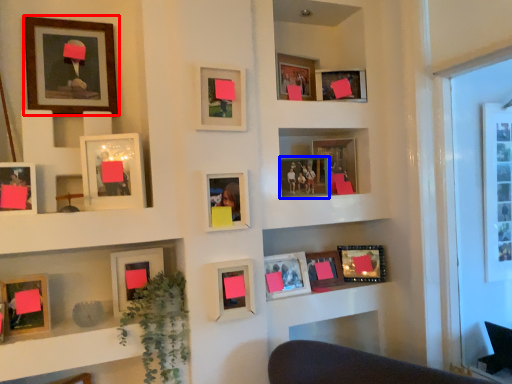
Question: Which of the following is the closest to the observer, picture frame (highlighted by a red box) or picture frame (highlighted by a blue box)?

Choices:
 (A) picture frame
 (B) picture frame

Answer: (A)